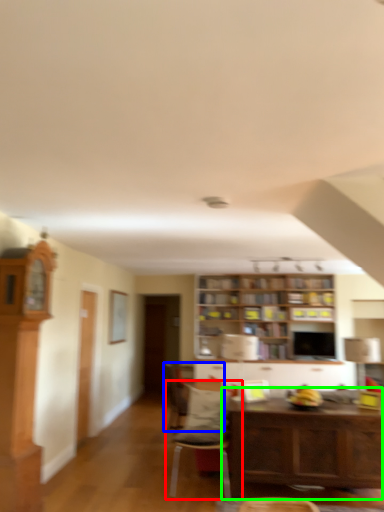
Question: Which object is the closest to the chair (highlighted by a red box)? Choose among these: chair (highlighted by a blue box) or table (highlighted by a green box).

Choices:
 (A) chair
 (B) table

Answer: (A)